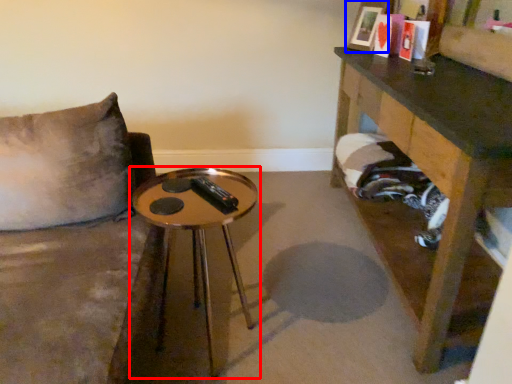
Question: Which object appears farthest to the camera in this image, table (highlighted by a red box) or picture frame (highlighted by a blue box)?

Choices:
 (A) table
 (B) picture frame

Answer: (B)